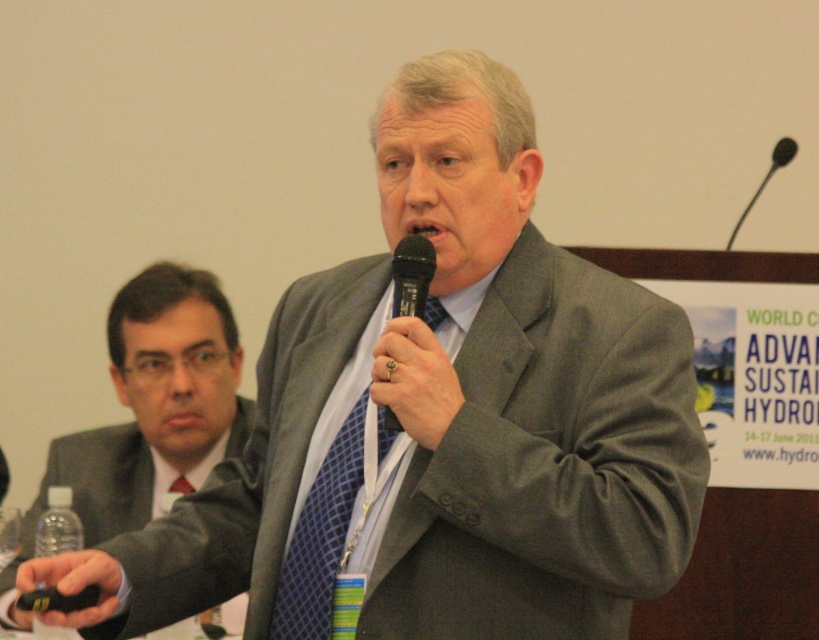
Question: Which object appears closest to the camera in this image?

Choices:
 (A) gold ring at center
 (B) matte black suit at left

Answer: (A)

Question: Among these points, which one is nearest to the camera?

Choices:
 (A) 412,259
 (B) 437,436
 (C) 137,419

Answer: (B)

Question: Does blue checkered tie at center have a lesser width compared to black plastic microphone at upper right?

Choices:
 (A) yes
 (B) no

Answer: (B)

Question: Is gold ring at center to the right of black plastic microphone at center from the viewer's perspective?

Choices:
 (A) yes
 (B) no

Answer: (A)

Question: Is matte black suit at left in front of black plastic microphone at upper right?

Choices:
 (A) yes
 (B) no

Answer: (A)

Question: Which point is closer to the camera?

Choices:
 (A) gold ring at center
 (B) black plastic microphone at center

Answer: (B)